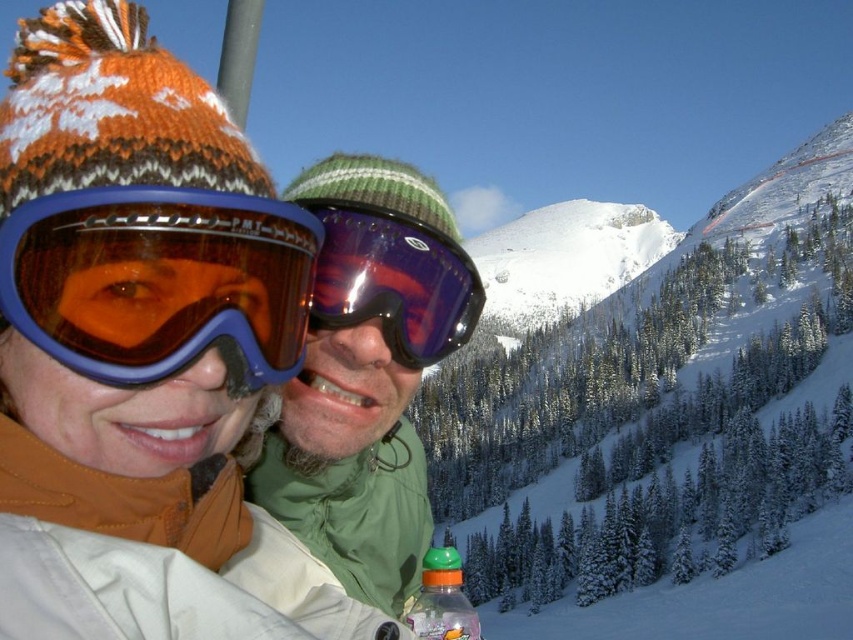
Who is positioned more to the left, purple reflective goggles at center or translucent plastic bottle at lower center?

From the viewer's perspective, purple reflective goggles at center appears more on the left side.

This screenshot has height=640, width=853. What do you see at coordinates (393, 282) in the screenshot? I see `purple reflective goggles at center` at bounding box center [393, 282].

Measure the distance between purple reflective goggles at center and camera.

purple reflective goggles at center and camera are 46.24 meters apart from each other.

This screenshot has width=853, height=640. In order to click on purple reflective goggles at center in this screenshot , I will do `click(393, 282)`.

Which of these two, matte orange knit hat at upper left or translucent plastic bottle at lower center, stands shorter?

Standing shorter between the two is translucent plastic bottle at lower center.

Based on the photo, can you confirm if matte orange knit hat at upper left is thinner than translucent plastic bottle at lower center?

No, matte orange knit hat at upper left is not thinner than translucent plastic bottle at lower center.

What are the coordinates of `matte orange knit hat at upper left` in the screenshot? It's located at pos(146,305).

This screenshot has width=853, height=640. I want to click on matte orange knit hat at upper left, so click(x=146, y=305).

Does matte orange knit hat at upper left have a smaller size compared to purple reflective goggles at center?

Actually, matte orange knit hat at upper left might be larger than purple reflective goggles at center.

Does matte orange knit hat at upper left have a lesser height compared to purple reflective goggles at center?

No.

Describe the element at coordinates (146, 305) in the screenshot. I see `matte orange knit hat at upper left` at that location.

Image resolution: width=853 pixels, height=640 pixels. Find the location of `matte orange knit hat at upper left`. matte orange knit hat at upper left is located at coordinates (146, 305).